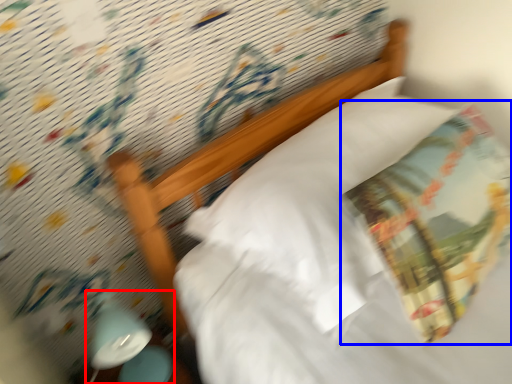
Question: Among these objects, which one is farthest to the camera, bedside lamp (highlighted by a red box) or throw pillow (highlighted by a blue box)?

Choices:
 (A) bedside lamp
 (B) throw pillow

Answer: (A)